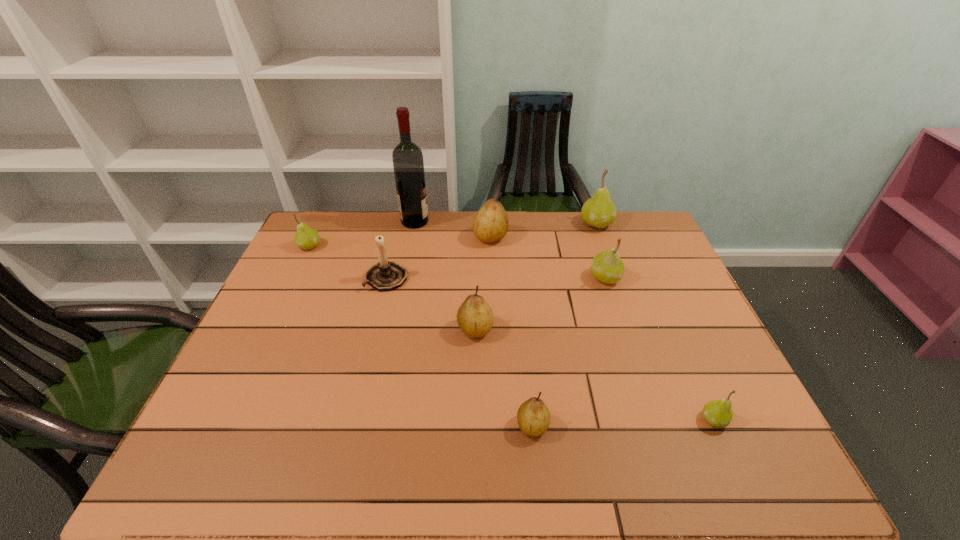
You are a GUI agent. You are given a task and a screenshot of the screen. Output one action in this format:
    pyautogui.click(x=<x>, y=<y>)
    Task: Click on the leftmost object
    The width and height of the screenshot is (960, 540).
    Given the screenshot: What is the action you would take?
    pyautogui.click(x=306, y=238)

Locate an element on the screen. The height and width of the screenshot is (540, 960). the leftmost pear is located at coordinates (306, 238).

I want to click on the nearest brown pear, so click(x=533, y=416).

Where is `the smallest green pear`? This screenshot has height=540, width=960. the smallest green pear is located at coordinates (718, 413).

What are the coordinates of `the rightmost object` in the screenshot? It's located at (718, 413).

This screenshot has width=960, height=540. What are the coordinates of `vacant space situated on the front and back of the alcohol` in the screenshot? It's located at (496, 221).

Find the location of a particular element. Image resolution: width=960 pixels, height=540 pixels. free space located on the left of the farthest green pear is located at coordinates (523, 224).

Where is `free space located 0.230m on the left of the farthest brown pear`? This screenshot has width=960, height=540. free space located 0.230m on the left of the farthest brown pear is located at coordinates (405, 237).

Find the location of a particular element. This screenshot has height=540, width=960. vacant space positioned 0.120m on the back of the second nearest green pear is located at coordinates (594, 244).

The image size is (960, 540). Find the location of `vacant space located 0.140m on the left of the candle holder`. vacant space located 0.140m on the left of the candle holder is located at coordinates (319, 278).